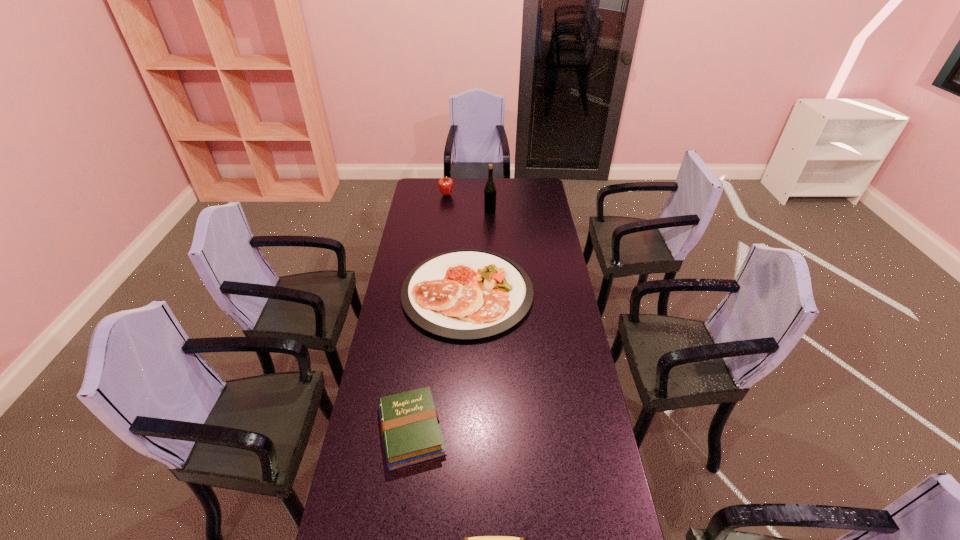
Find the location of `beer bottle`. beer bottle is located at coordinates (490, 189).

Where is `the tallest object`? Image resolution: width=960 pixels, height=540 pixels. the tallest object is located at coordinates (490, 189).

Locate an element on the screen. the second tallest object is located at coordinates (445, 184).

Find the location of a particular element. apple is located at coordinates (445, 184).

The image size is (960, 540). What are the coordinates of `the third nearest object` in the screenshot? It's located at (467, 294).

Locate an element on the screen. the second nearest object is located at coordinates (410, 427).

At what (x,y) coordinates should I click in order to perform the action: click on vacant space situated on the front of the tallest object. Please return your answer as a coordinate pair (x, y). Looking at the image, I should click on (491, 219).

Where is `blank space located on the right of the apple`? The width and height of the screenshot is (960, 540). blank space located on the right of the apple is located at coordinates (495, 195).

This screenshot has height=540, width=960. I want to click on vacant space located on the back of the dish, so click(x=469, y=236).

Locate an element on the screen. Image resolution: width=960 pixels, height=540 pixels. blank area located on the right of the book is located at coordinates (489, 430).